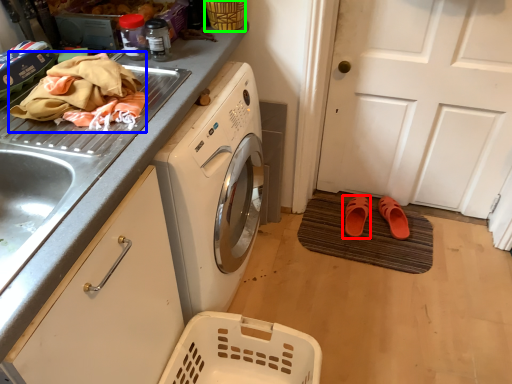
Question: Which object is positioned closest to footwear (highlighted by a red box)? Select from material (highlighted by a blue box) and basket (highlighted by a green box).

Choices:
 (A) material
 (B) basket

Answer: (B)